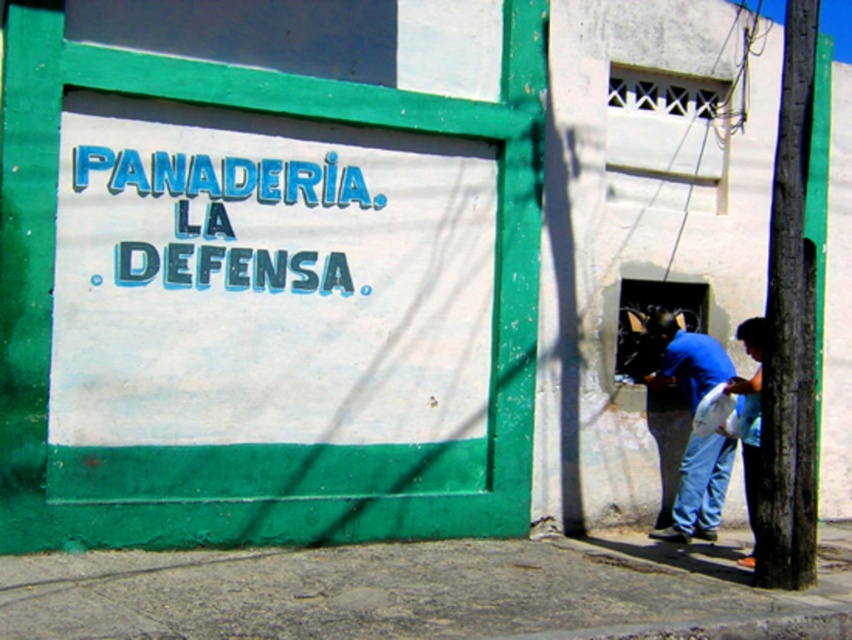
You are standing in front of the bakery and want to know which of the two points, point (801, 259) or point (722, 436), is closer to you. Based on the scene description, which point is nearer?

Point (801, 259) is closer to the viewer than point (722, 436).

You are a photographer trying to capture a clear photo of the PANADERIA LA DEFENSA sign. However, two people are blocking your view. The blue cotton shirt at lower right and the blue denim jeans at lower right are in the way. Which object should you move to get a better view of the sign?

The blue cotton shirt at lower right might be wider than blue denim jeans at lower right, so moving the blue cotton shirt at lower right would likely provide a clearer view of the sign since it occupies more space.